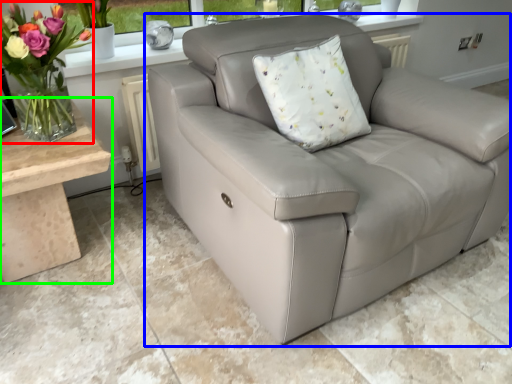
Question: Based on their relative distances, which object is farther from floral arrangement (highlighted by a red box)? Choose from studio couch (highlighted by a blue box) and table (highlighted by a green box).

Choices:
 (A) studio couch
 (B) table

Answer: (A)